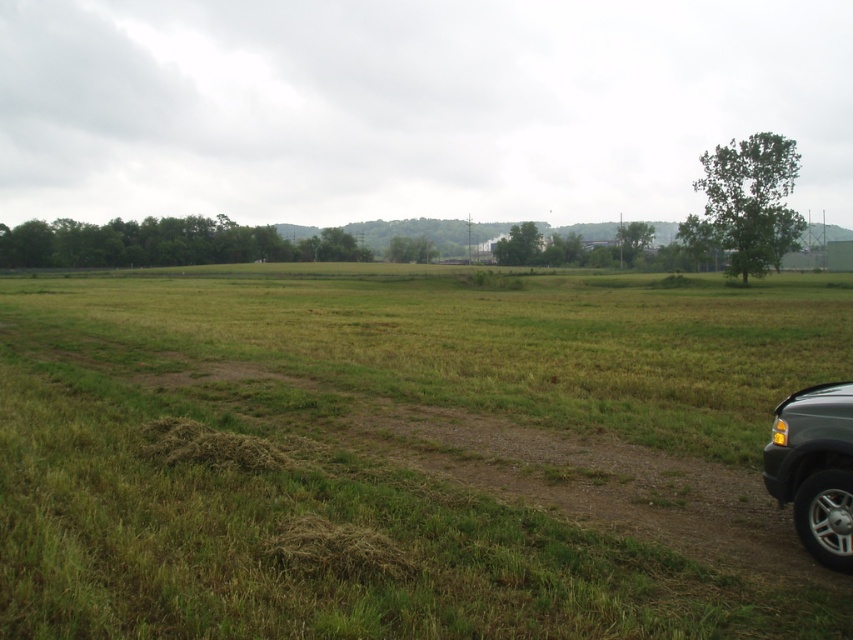
Question: Among these objects, which one is nearest to the camera?

Choices:
 (A) green grassy field at center
 (B) metallic gray suv at lower right

Answer: (A)

Question: Where is green grassy field at center located in relation to metallic gray suv at lower right in the image?

Choices:
 (A) right
 (B) left

Answer: (B)

Question: Does green grassy field at center lie behind metallic gray suv at lower right?

Choices:
 (A) yes
 (B) no

Answer: (B)

Question: Which point is farther from the camera taking this photo?

Choices:
 (A) [831, 403]
 (B) [502, 556]

Answer: (A)

Question: Does green grassy field at center have a smaller size compared to metallic gray suv at lower right?

Choices:
 (A) no
 (B) yes

Answer: (A)